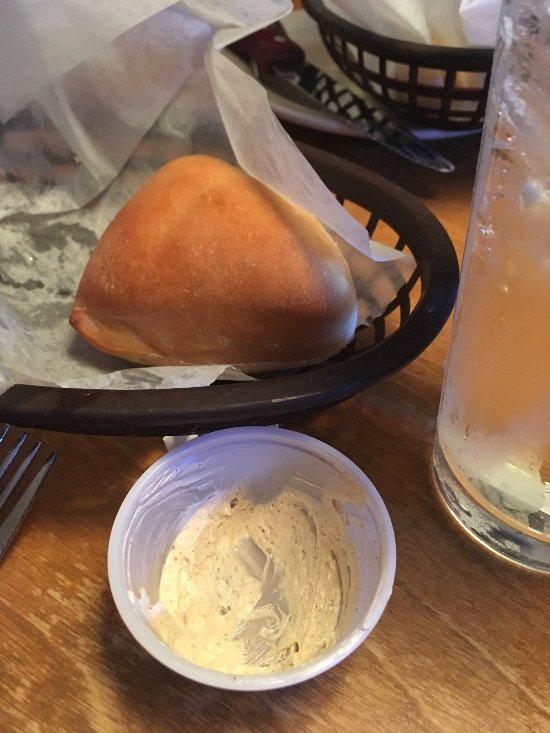
This screenshot has width=550, height=733. I want to click on sheet, so click(x=398, y=69).